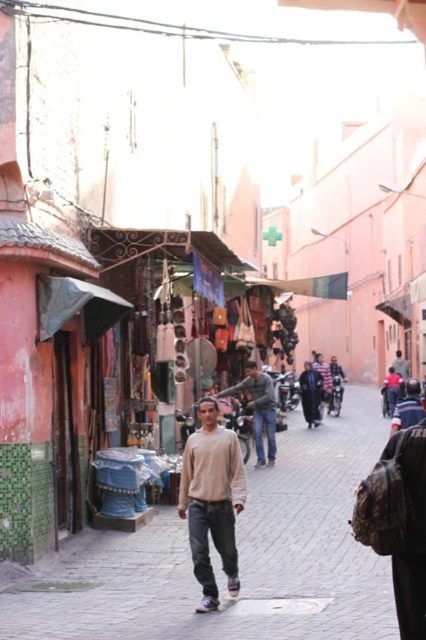
Is beige cotton sweater at center bigger than light brown leather jacket at center?

Yes, beige cotton sweater at center is bigger than light brown leather jacket at center.

What do you see at coordinates (212, 499) in the screenshot? I see `beige cotton sweater at center` at bounding box center [212, 499].

Who is more forward, (204, 467) or (256, 452)?

Point (204, 467) is more forward.

Where is `beige cotton sweater at center`? beige cotton sweater at center is located at coordinates (212, 499).

Between beige cotton sweater at center and light brown sweater at center, which one has more height?

beige cotton sweater at center is taller.

Describe the element at coordinates (212, 499) in the screenshot. I see `beige cotton sweater at center` at that location.

This screenshot has width=426, height=640. Find the location of `beige cotton sweater at center`. beige cotton sweater at center is located at coordinates (212, 499).

Between matte beige man at center and light brown sweater at center, which one appears on the left side from the viewer's perspective?

matte beige man at center is more to the left.

Which is in front, point (111, 570) or point (416, 384)?

Point (111, 570) is more forward.

This screenshot has width=426, height=640. Find the location of `matte beige man at center`. matte beige man at center is located at coordinates (238, 557).